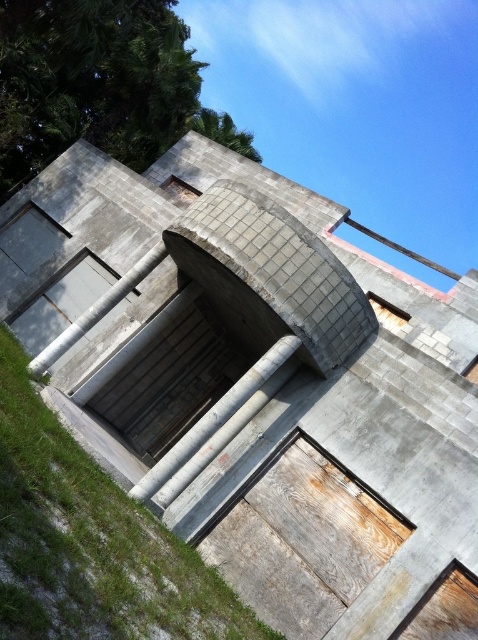
Question: Which of the following is the closest to the observer?

Choices:
 (A) wooden door at center
 (B) concrete/wooden at center

Answer: (A)

Question: Considering the relative positions of wooden door at center and concrete/wooden at center in the image provided, where is wooden door at center located with respect to concrete/wooden at center?

Choices:
 (A) below
 (B) above

Answer: (A)

Question: Is wooden door at center positioned behind concrete/wooden at center?

Choices:
 (A) yes
 (B) no

Answer: (B)

Question: Is wooden door at center closer to camera compared to concrete/wooden at center?

Choices:
 (A) no
 (B) yes

Answer: (B)